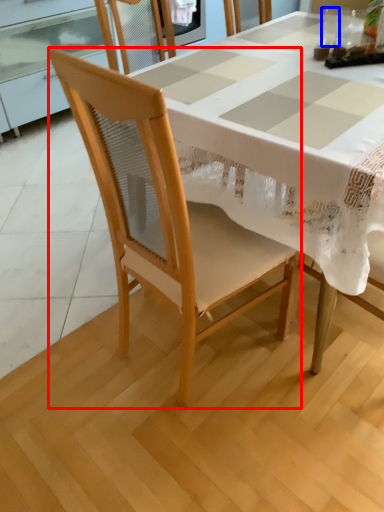
Question: Which of the following is the closest to the observer, chair (highlighted by a red box) or tableware (highlighted by a blue box)?

Choices:
 (A) chair
 (B) tableware

Answer: (A)